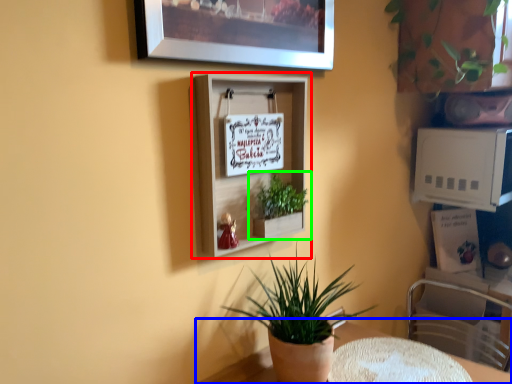
Question: Estimate the real-world distances between objects in this image. Which object is farther from shelf (highlighted by a red box), table (highlighted by a blue box) or houseplant (highlighted by a green box)?

Choices:
 (A) table
 (B) houseplant

Answer: (A)